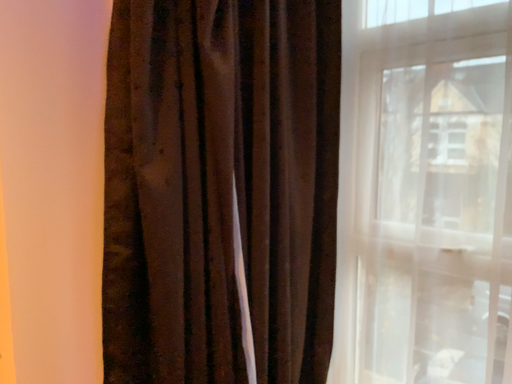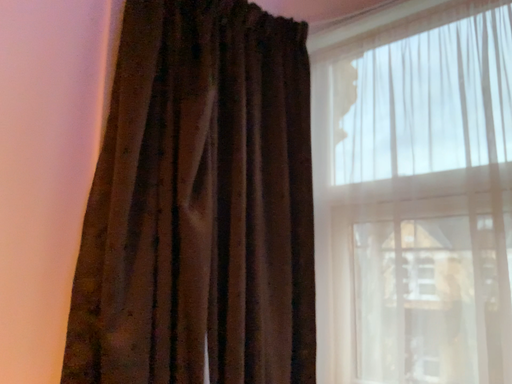
Question: Which way did the camera rotate in the video?

Choices:
 (A) rotated upward
 (B) rotated downward

Answer: (A)